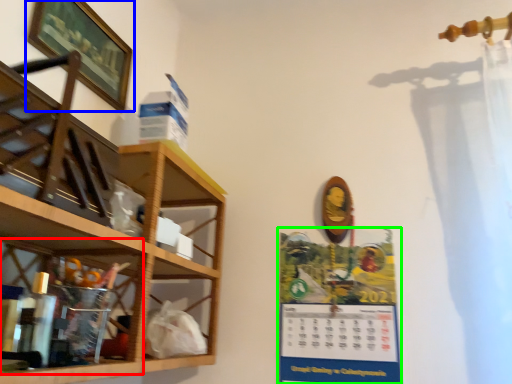
Question: Which object is positioned closest to cabinet (highlighted by a red box)? Select from picture frame (highlighted by a blue box) and poster page (highlighted by a green box).

Choices:
 (A) picture frame
 (B) poster page

Answer: (A)